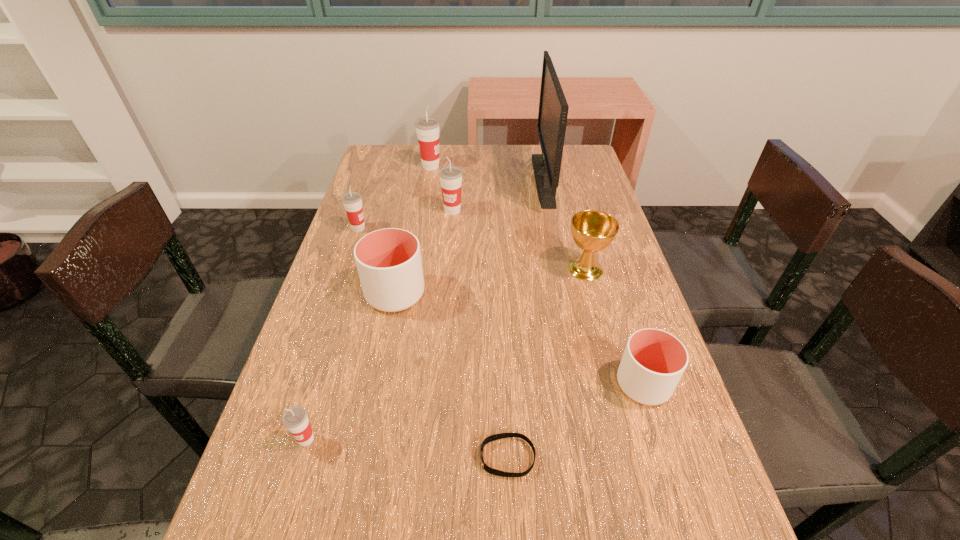
Find the location of `monitor`. monitor is located at coordinates (553, 108).

Identify the location of the third red cup from left to right. (427, 128).

This screenshot has width=960, height=540. I want to click on the farthest cup, so click(427, 128).

Identify the location of the fifth nearest cup. Image resolution: width=960 pixels, height=540 pixels. (450, 176).

Where is `the fifth object from right to left`? This screenshot has height=540, width=960. the fifth object from right to left is located at coordinates (450, 176).

Locate an element on the screen. This screenshot has height=540, width=960. chalice is located at coordinates (592, 230).

The height and width of the screenshot is (540, 960). What are the coordinates of `the fourth nearest cup` in the screenshot? It's located at (352, 201).

Where is `the third farthest red cup`? the third farthest red cup is located at coordinates (352, 201).

This screenshot has width=960, height=540. Find the location of `the left white cup`. the left white cup is located at coordinates (389, 264).

Locate an element on the screen. the farther white cup is located at coordinates (389, 264).